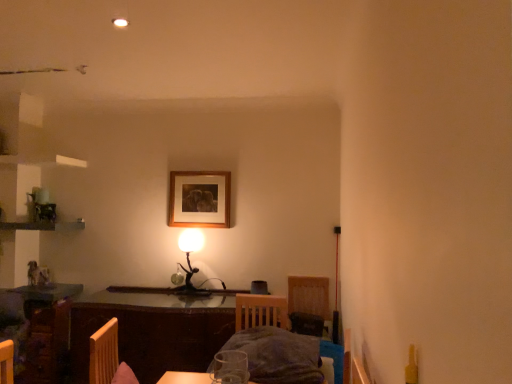
Question: Is wooden picture frame at upper center outside of wooden table at center?

Choices:
 (A) no
 (B) yes

Answer: (B)

Question: Can you confirm if wooden picture frame at upper center is positioned to the left of wooden table at center?

Choices:
 (A) yes
 (B) no

Answer: (B)

Question: Is wooden table at center at the back of wooden picture frame at upper center?

Choices:
 (A) no
 (B) yes

Answer: (A)

Question: Does wooden picture frame at upper center contain wooden table at center?

Choices:
 (A) yes
 (B) no

Answer: (B)

Question: Does wooden picture frame at upper center have a greater height compared to wooden table at center?

Choices:
 (A) no
 (B) yes

Answer: (A)

Question: Is wooden picture frame at upper center bigger than wooden table at center?

Choices:
 (A) no
 (B) yes

Answer: (A)

Question: Is metallic gold table lamp at center oriented towards dark gray fabric bed at center?

Choices:
 (A) yes
 (B) no

Answer: (B)

Question: Are metallic gold table lamp at center and dark gray fabric bed at center located far from each other?

Choices:
 (A) yes
 (B) no

Answer: (A)

Question: Is metallic gold table lamp at center thinner than dark gray fabric bed at center?

Choices:
 (A) yes
 (B) no

Answer: (A)

Question: From a real-world perspective, is metallic gold table lamp at center below dark gray fabric bed at center?

Choices:
 (A) no
 (B) yes

Answer: (A)

Question: Is metallic gold table lamp at center taller than dark gray fabric bed at center?

Choices:
 (A) yes
 (B) no

Answer: (A)

Question: Is dark gray fabric bed at center a part of metallic gold table lamp at center?

Choices:
 (A) yes
 (B) no

Answer: (B)

Question: Is metallic gold table lamp at center aimed at wooden picture frame at upper center?

Choices:
 (A) no
 (B) yes

Answer: (A)